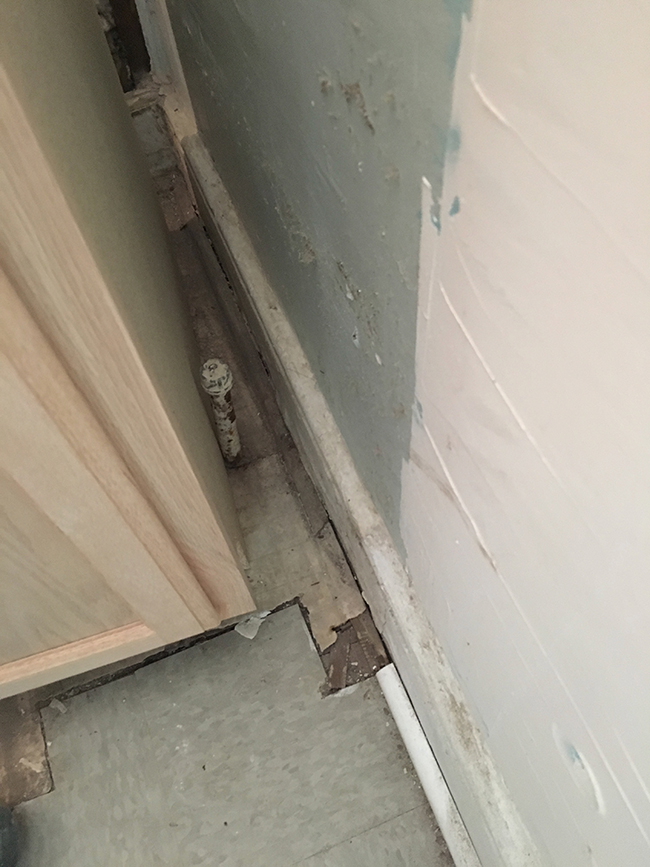
The height and width of the screenshot is (867, 650). In order to click on light gray paint on wall in this screenshot , I will do `click(562, 323)`.